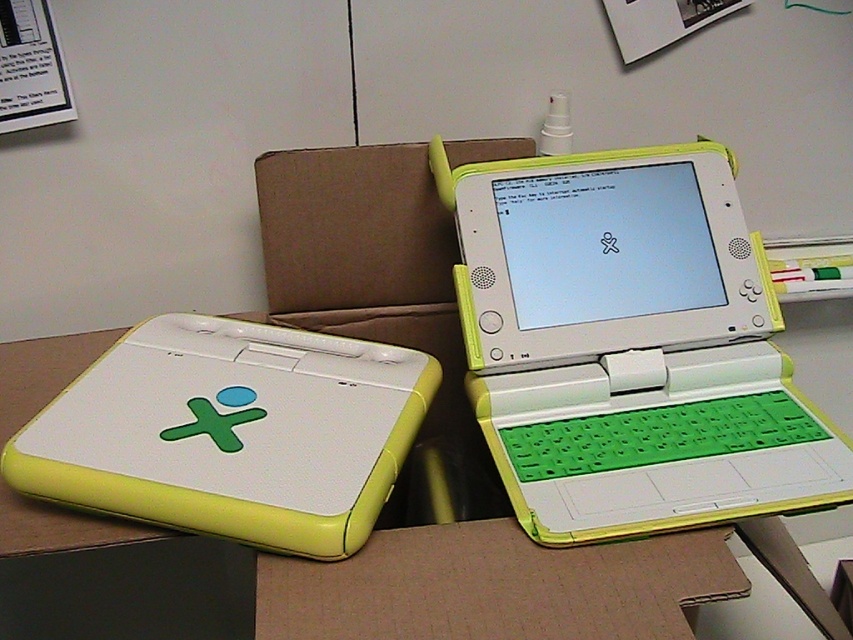
Question: Which point appears farthest from the camera in this image?

Choices:
 (A) (369, 236)
 (B) (589, 392)
 (C) (71, 417)
 (D) (692, 552)

Answer: (A)

Question: Is white plastic table at center wider than brown cardboard at center?

Choices:
 (A) no
 (B) yes

Answer: (B)

Question: Which point appears closest to the camera in this image?

Choices:
 (A) (136, 529)
 (B) (572, 493)

Answer: (A)

Question: Is white matte laptop at lower left to the left of brown cardboard at center from the viewer's perspective?

Choices:
 (A) yes
 (B) no

Answer: (A)

Question: Which point is farther from the camera taking this photo?

Choices:
 (A) (584, 296)
 (B) (392, 234)
 (C) (375, 609)
 (D) (270, 451)

Answer: (B)

Question: Can you confirm if white matte laptop at lower left is smaller than white plastic table at center?

Choices:
 (A) no
 (B) yes

Answer: (B)